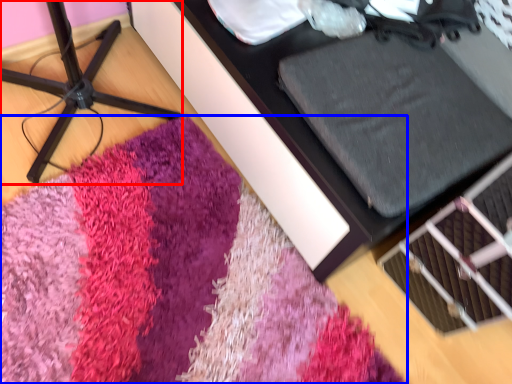
Question: Which of the following is the closest to the observer, furniture (highlighted by a red box) or mat (highlighted by a blue box)?

Choices:
 (A) furniture
 (B) mat

Answer: (A)